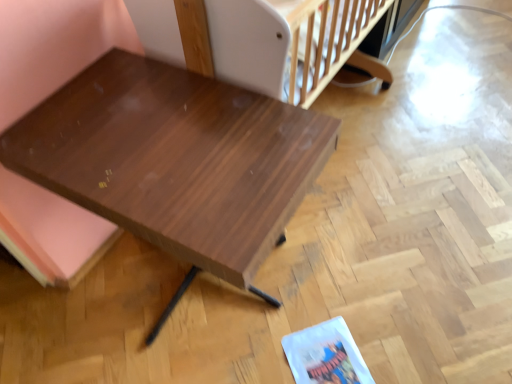
At what (x,y) coordinates should I click in order to perform the action: click on spots to the right of shiny brown wood table at center. Please return your answer as a coordinate pair (x, y). The image size is (512, 384). Looking at the image, I should click on (378, 262).